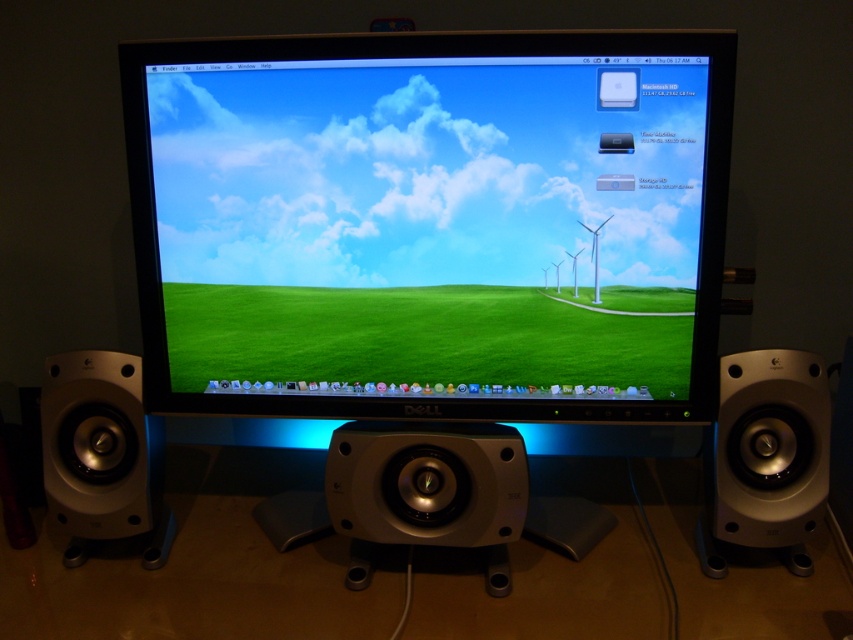
Question: Which object is positioned farthest from the matte plastic monitor at center?

Choices:
 (A) silver metallic speaker at left
 (B) silver metallic speaker at right

Answer: (B)

Question: Considering the real-world distances, which object is closest to the matte plastic monitor at center?

Choices:
 (A) silver metallic speaker at left
 (B) silver metallic speaker at right

Answer: (A)

Question: Can you confirm if matte plastic monitor at center is smaller than silver metallic speaker at left?

Choices:
 (A) yes
 (B) no

Answer: (B)

Question: Is matte plastic monitor at center below silver metallic speaker at left?

Choices:
 (A) yes
 (B) no

Answer: (B)

Question: Does silver metallic speaker at right have a larger size compared to silver metallic speaker at left?

Choices:
 (A) no
 (B) yes

Answer: (B)

Question: Which of the following is the farthest from the observer?

Choices:
 (A) (468, 317)
 (B) (753, 444)

Answer: (A)